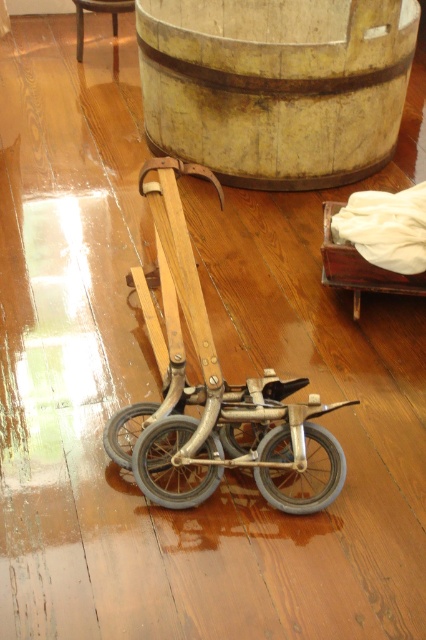
Based on the photo, you are a parent trying to move the metallic silver tricycle at center and the metallic silver wheel at lower center to a different room. If you want to carry the tricycle first, which object should you pick up first to ensure you don

The metallic silver tricycle at center is positioned on the right side of metallic silver wheel at lower center. Since you want to carry the tricycle first, you should pick up the metallic silver wheel at lower center first to avoid obstruction.

You are a child trying to reach the gray rubber wheel at center from the wooden barrel at upper center. Which object is closer to you?

The wooden barrel at upper center is closer to you because it is positioned further to the viewer than the gray rubber wheel at center, meaning you can reach it first.